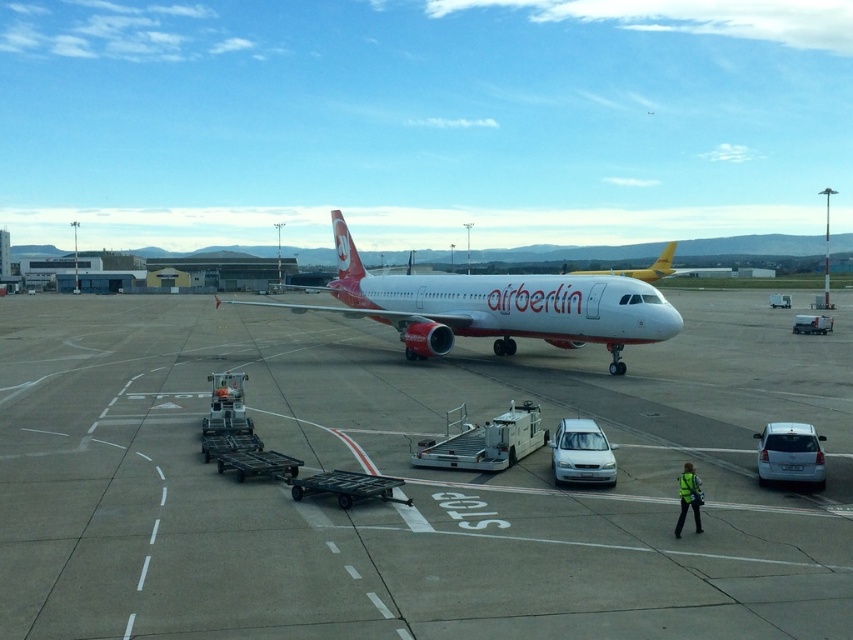
Question: Is white smooth tarmac at center positioned behind white glossy airplane at center?

Choices:
 (A) no
 (B) yes

Answer: (A)

Question: Which object is farther from the camera taking this photo?

Choices:
 (A) white smooth tarmac at center
 (B) white glossy airplane at center
 (C) yellow metallic airplane at center

Answer: (C)

Question: Considering the real-world distances, which object is farthest from the white smooth tarmac at center?

Choices:
 (A) yellow metallic airplane at center
 (B) white glossy airplane at center

Answer: (A)

Question: Which point is closer to the camera taking this photo?

Choices:
 (A) (762, 408)
 (B) (231, 301)

Answer: (A)

Question: Can you confirm if white glossy airplane at center is bigger than yellow metallic airplane at center?

Choices:
 (A) yes
 (B) no

Answer: (B)

Question: Is white smooth tarmac at center below yellow metallic airplane at center?

Choices:
 (A) no
 (B) yes

Answer: (B)